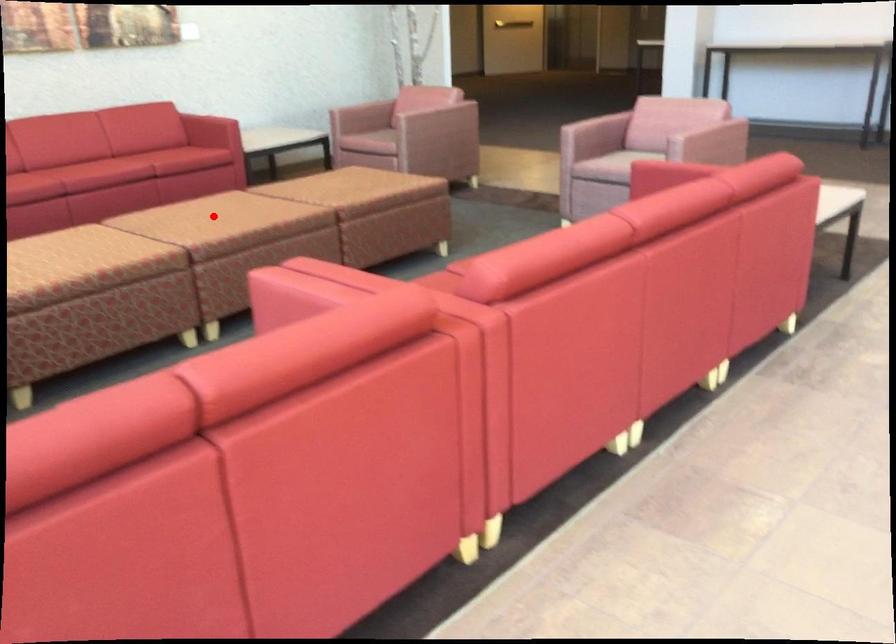
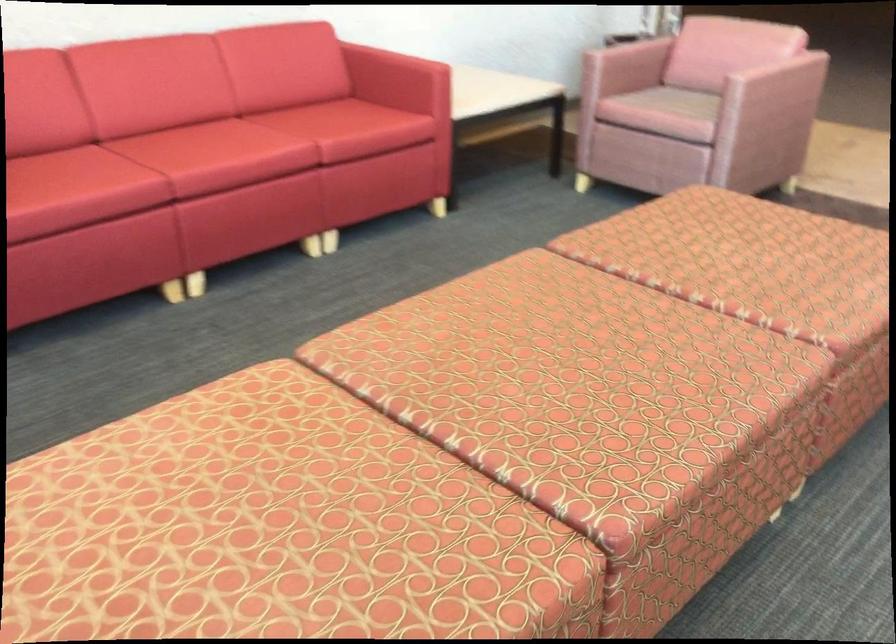
Question: I am providing you with two images of the same scene from different viewpoints. Given a red point in image1, look at the same physical point in image2. Is it:

Choices:
 (A) Closer to the viewpoint
 (B) Farther from the viewpoint

Answer: (A)